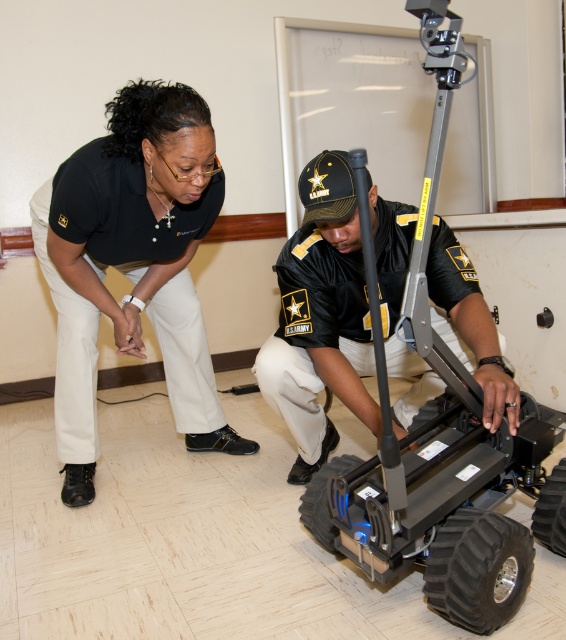
Is point (109, 236) closer to camera compared to point (299, 426)?

Yes, it is in front of point (299, 426).

Which is behind, point (41, 234) or point (340, 195)?

The point (41, 234) is more distant.

Is point (74, 209) farther from camera compared to point (479, 298)?

That is True.

You are a GUI agent. You are given a task and a screenshot of the screen. Output one action in this format:
    pyautogui.click(x=<x>, y=<y>)
    Task: Click on the black uniform at left
    
    Given the screenshot: What is the action you would take?
    pyautogui.click(x=132, y=266)